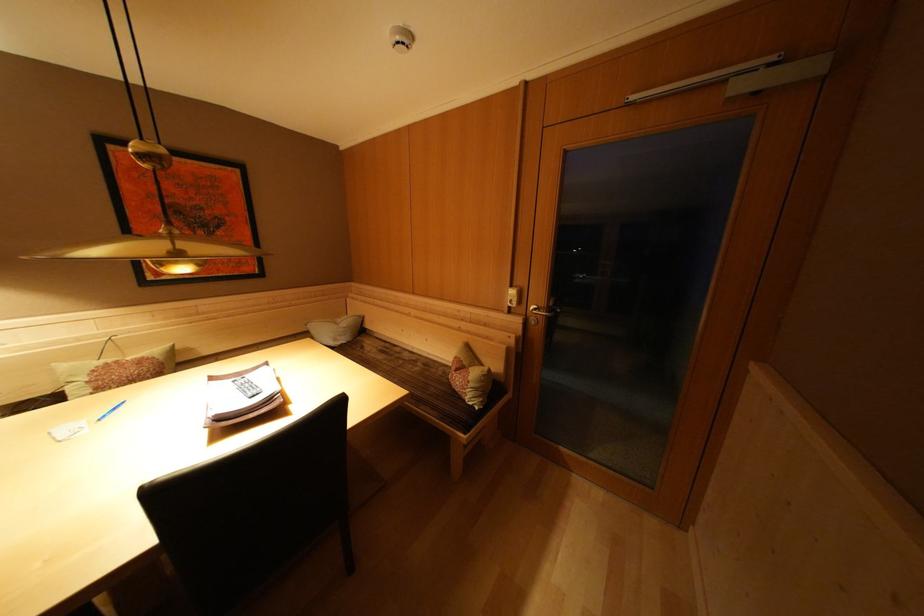
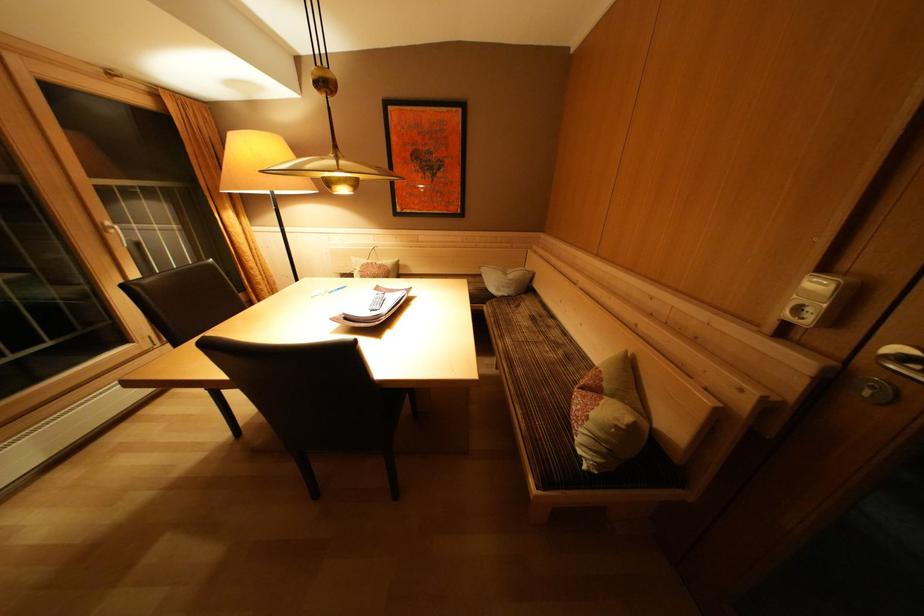
Locate, in the second image, the point that corresponds to (x=351, y=329) in the first image.

(517, 281)